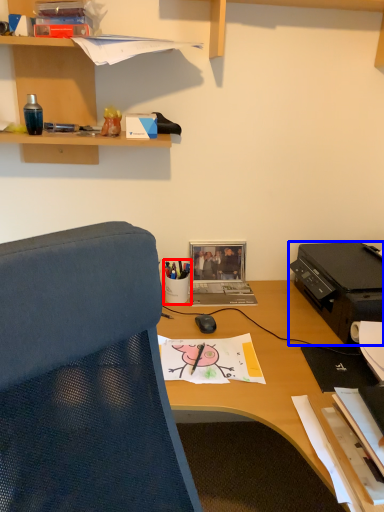
Question: Which object is further to the camera taking this photo, stationery (highlighted by a red box) or printer (highlighted by a blue box)?

Choices:
 (A) stationery
 (B) printer

Answer: (A)